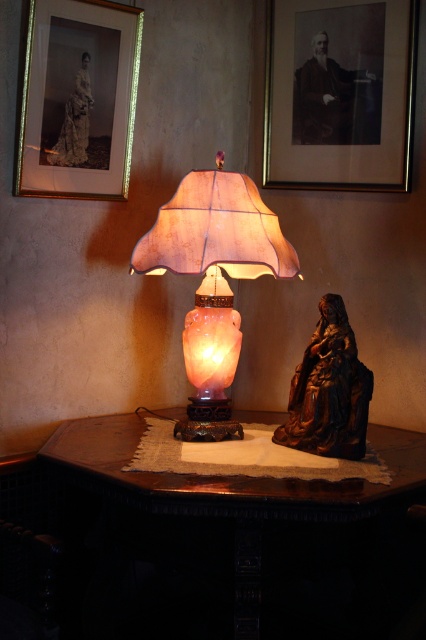
Question: Is black paper portrait at upper center bigger than pink alabaster lamp at center?

Choices:
 (A) no
 (B) yes

Answer: (A)

Question: Which of the following is the closest to the observer?

Choices:
 (A) (363, 106)
 (B) (173, 227)
 (C) (316, 436)
 (D) (123, 156)

Answer: (B)

Question: Which point appears closest to the camera in this image?

Choices:
 (A) (264, 170)
 (B) (371, 570)
 (C) (57, 42)
 (D) (167, 253)

Answer: (D)

Question: Does wooden table at center lie in front of gold-framed photograph at upper left?

Choices:
 (A) yes
 (B) no

Answer: (A)

Question: Considering the real-world distances, which object is closest to the black paper portrait at upper center?

Choices:
 (A) gold-framed photograph at upper left
 (B) bronze statue at right
 (C) pink alabaster lamp at center
 (D) wooden table at center

Answer: (A)

Question: Can you confirm if wooden table at center is positioned to the right of black paper portrait at upper center?

Choices:
 (A) yes
 (B) no

Answer: (B)